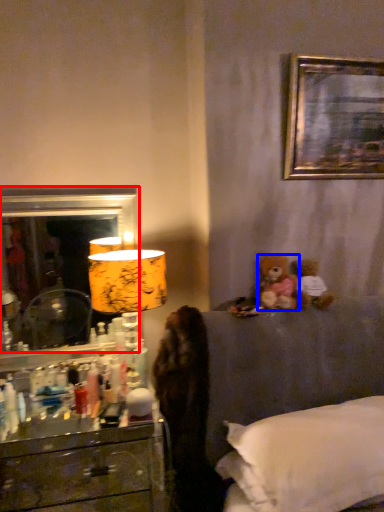
Question: Which point is further to the camera, mirror (highlighted by a red box) or teddy bear (highlighted by a blue box)?

Choices:
 (A) mirror
 (B) teddy bear

Answer: (A)